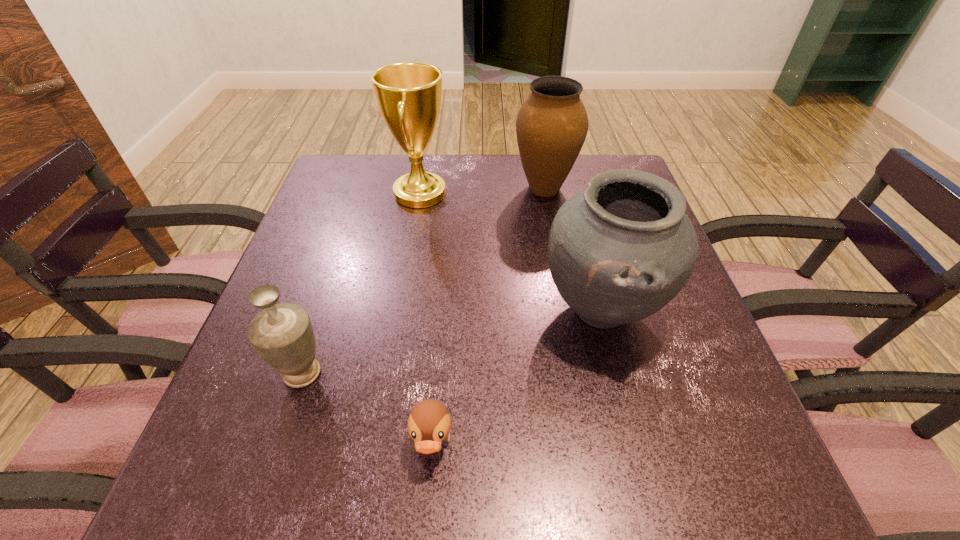
This screenshot has width=960, height=540. What are the coordinates of `award` in the screenshot? It's located at (408, 94).

This screenshot has width=960, height=540. What are the coordinates of `the farthest urn` in the screenshot? It's located at (552, 124).

This screenshot has width=960, height=540. What are the coordinates of `the second shortest object` in the screenshot? It's located at (282, 334).

Locate an element on the screen. This screenshot has width=960, height=540. the leftmost urn is located at coordinates (282, 334).

This screenshot has width=960, height=540. I want to click on the shortest object, so click(x=429, y=423).

Identify the location of the nearest object. (429, 423).

This screenshot has height=540, width=960. Identify the location of free location located by the handles of the award. (487, 194).

The width and height of the screenshot is (960, 540). Find the location of `free location located on the left of the farthest urn`. free location located on the left of the farthest urn is located at coordinates (389, 188).

The height and width of the screenshot is (540, 960). In order to click on blank space located 0.380m on the back of the leftmost urn in this screenshot , I will do `click(352, 222)`.

The image size is (960, 540). Find the location of `award that is at the far edge`. award that is at the far edge is located at coordinates (408, 94).